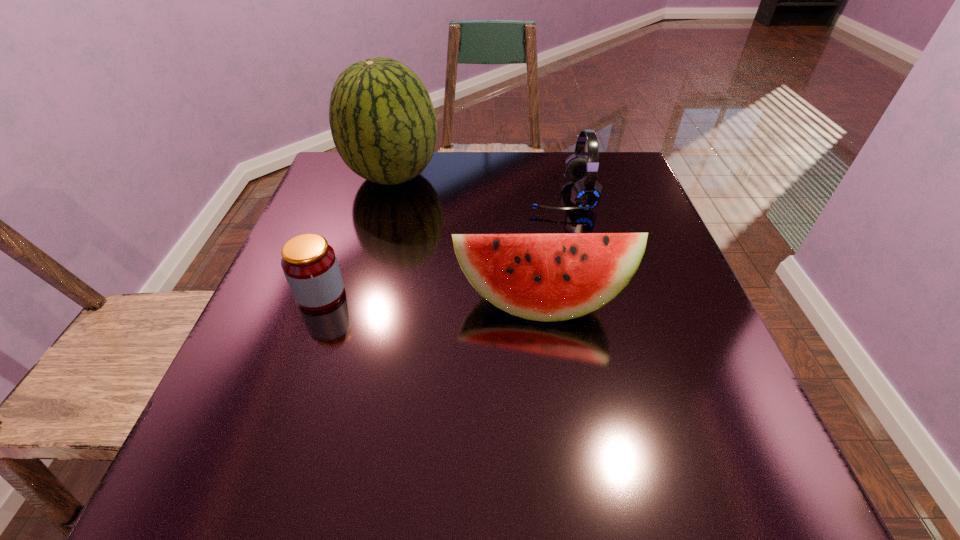
In the image, there is a desktop. Identify the location of vacant space at the far edge. (504, 169).

Locate an element on the screen. This screenshot has height=540, width=960. vacant space at the near edge of the desktop is located at coordinates (363, 463).

The image size is (960, 540). In the image, there is a desktop. Identify the location of vacant region at the left edge. (281, 389).

Image resolution: width=960 pixels, height=540 pixels. In the image, there is a desktop. Identify the location of blank space at the right edge. (632, 311).

The image size is (960, 540). I want to click on vacant area at the far right corner, so click(x=618, y=158).

Locate an element on the screen. Image resolution: width=960 pixels, height=540 pixels. unoccupied position between the headset and the shortest object is located at coordinates (441, 245).

Find the location of a particular element. The height and width of the screenshot is (540, 960). blank region between the headset and the jar is located at coordinates (441, 245).

You are a GUI agent. You are given a task and a screenshot of the screen. Output one action in this format:
    pyautogui.click(x=<x>, y=<y>)
    Task: Click on the unoccupied area between the right watermelon and the jar
    Image resolution: width=960 pixels, height=540 pixels.
    Given the screenshot: What is the action you would take?
    pyautogui.click(x=430, y=298)

You are a GUI agent. You are given a task and a screenshot of the screen. Output one action in this format:
    pyautogui.click(x=<x>, y=<y>)
    Task: Click on the vacant space that's between the jar and the headset
    The width and height of the screenshot is (960, 540).
    Given the screenshot: What is the action you would take?
    pyautogui.click(x=441, y=245)

At what (x,y) coordinates should I click in order to perform the action: click on empty space that is in between the taller watermelon and the headset. Please return your answer as a coordinate pair (x, y). The image size is (960, 540). Looking at the image, I should click on (477, 186).